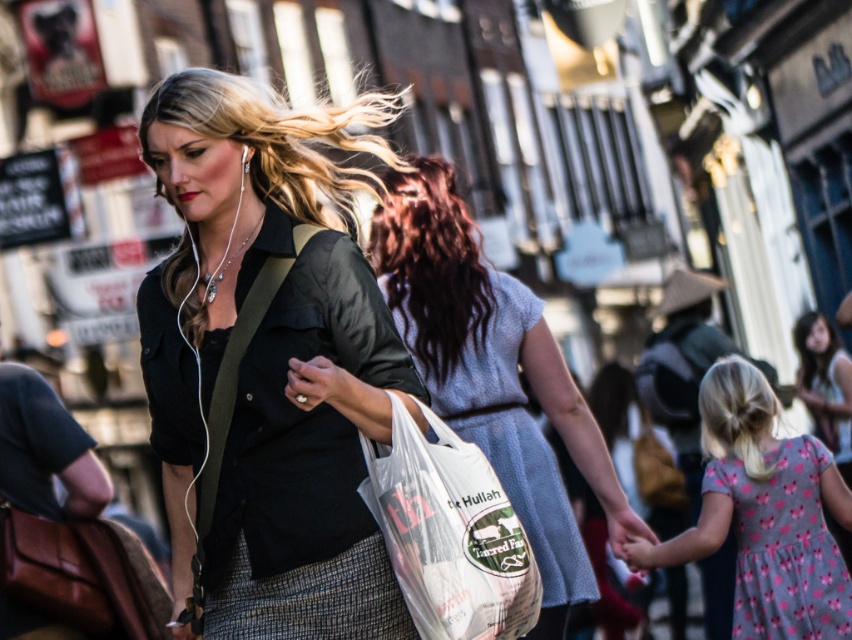
You are a photographer standing on the sidewalk observing the scene. You notice the matte black shirt at center and the pink fabric dress at lower right. Which clothing item is covering part of the other?

The matte black shirt at center is positioned over the pink fabric dress at lower right, so it is covering part of it.